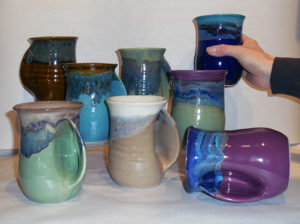
This screenshot has width=300, height=224. Identify the location of vases. (42, 149), (149, 131), (94, 102), (148, 65), (40, 65), (213, 113), (222, 20), (249, 181).